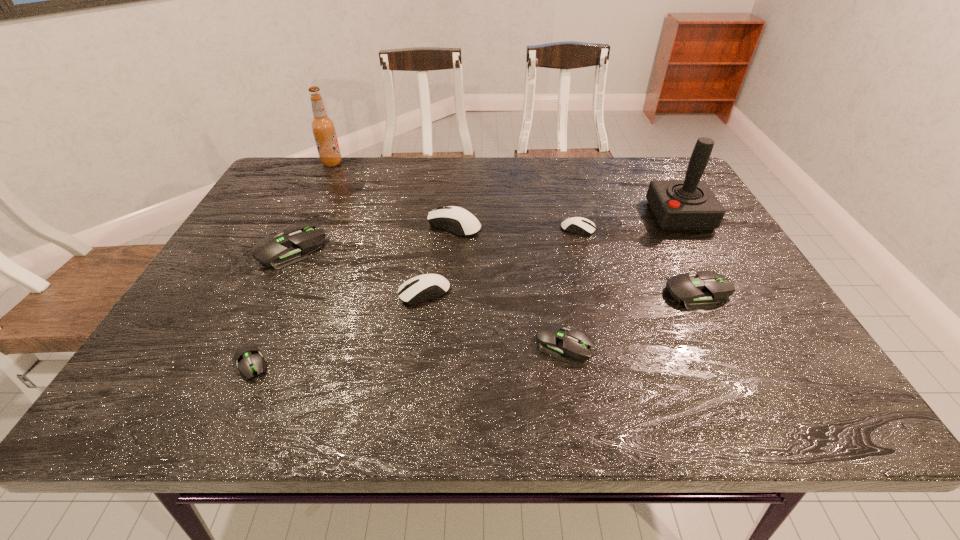
At what (x,y) coordinates should I click in order to perform the action: click on vacant space located on the right of the smallest white mouse. Please return your answer as a coordinate pair (x, y). Looking at the image, I should click on [677, 230].

Identify the location of vacant space located on the back of the second gray computer mouse from right to left. (549, 255).

At what (x,y) coordinates should I click in order to perform the action: click on free space located on the back of the shortest computer mouse. Please return your answer as a coordinate pair (x, y). This screenshot has width=960, height=540. Looking at the image, I should click on (313, 227).

The image size is (960, 540). I want to click on object at the far edge, so click(323, 127).

Image resolution: width=960 pixels, height=540 pixels. Find the location of `object present at the near edge`. object present at the near edge is located at coordinates (248, 358).

At what (x,y) coordinates should I click in order to perform the action: click on beer bottle situated at the left edge. Please return your answer as a coordinate pair (x, y). Looking at the image, I should click on (323, 127).

Where is `joystick that is at the right edge`? joystick that is at the right edge is located at coordinates (689, 204).

I want to click on computer mouse at the right edge, so click(x=696, y=291).

Identify the location of object present at the far left corner. The width and height of the screenshot is (960, 540). (323, 127).

The height and width of the screenshot is (540, 960). I want to click on object at the near left corner, so pos(248,358).